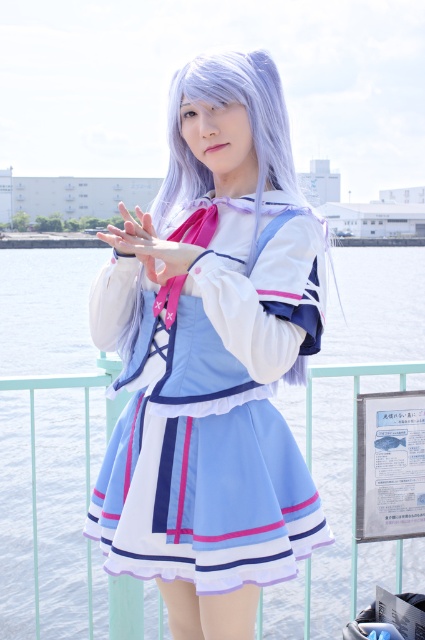
Question: Which of the following is the closest to the observer?

Choices:
 (A) (232, 529)
 (B) (20, 320)

Answer: (A)

Question: From the image, what is the correct spatial relationship of satin blue dress at center in relation to light blue fabric dress at center?

Choices:
 (A) right
 (B) left

Answer: (B)

Question: Observing the image, what is the correct spatial positioning of satin blue dress at center in reference to light blue fabric dress at center?

Choices:
 (A) left
 (B) right

Answer: (A)

Question: Considering the relative positions of satin blue dress at center and light blue fabric dress at center in the image provided, where is satin blue dress at center located with respect to light blue fabric dress at center?

Choices:
 (A) below
 (B) above

Answer: (A)